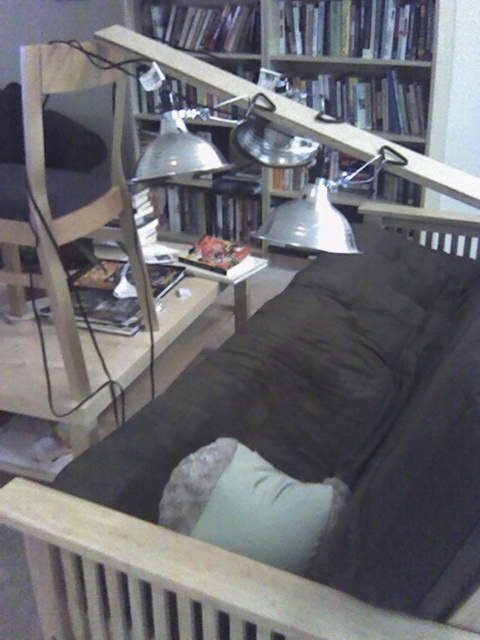
From the picture: You are sitting on the wooden chair at left and want to reach the wooden slats at lower center. Which direction should you move to get closer to them?

You should move to the right to get closer to the wooden slats at lower center since they are located to the right of the wooden chair at left.